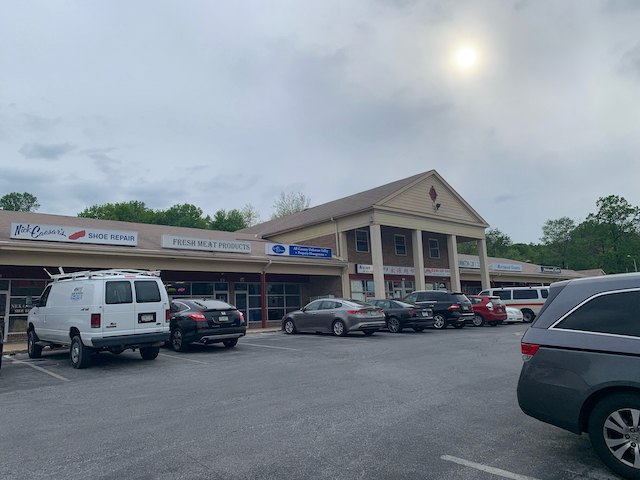
Identify the location of pillars. The height and width of the screenshot is (480, 640). (381, 254), (416, 263), (456, 273), (486, 276).